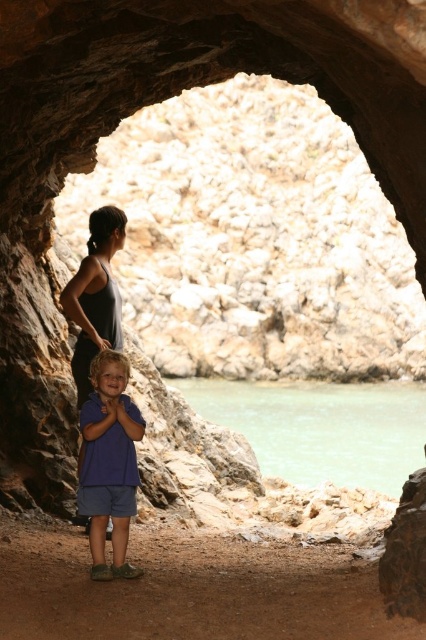
Question: Which object is the farthest from the matte gray tank top at center?

Choices:
 (A) blue cotton shirt at center
 (B) green water at lower center

Answer: (B)

Question: Is green water at lower center above rusty rock at lower right?

Choices:
 (A) no
 (B) yes

Answer: (A)

Question: Is green water at lower center behind rusty rock at lower right?

Choices:
 (A) yes
 (B) no

Answer: (A)

Question: Which point is farther to the camera?

Choices:
 (A) (120, 448)
 (B) (325, 472)

Answer: (B)

Question: Is green water at lower center below rusty rock at lower right?

Choices:
 (A) no
 (B) yes

Answer: (B)

Question: Among these points, which one is farthest from the camera?

Choices:
 (A) (81, 289)
 (B) (408, 564)
 (C) (310, 476)
 (D) (103, 420)

Answer: (C)